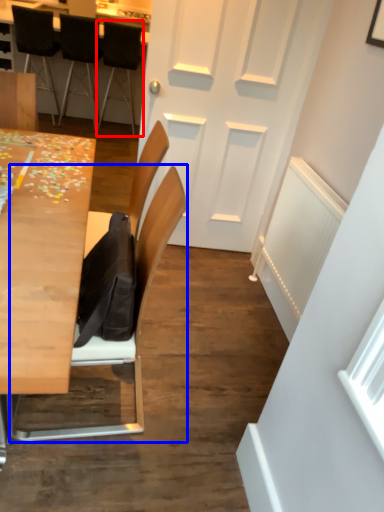
Question: Which object appears farthest to the camera in this image, chair (highlighted by a red box) or chair (highlighted by a blue box)?

Choices:
 (A) chair
 (B) chair

Answer: (A)